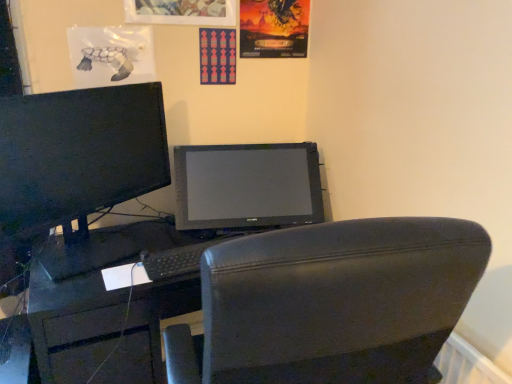
Identify the location of matte pink poster at upper center, which is the first poster page from left to right. The height and width of the screenshot is (384, 512). (217, 56).

In the scene shown: How much space does matte paper poster at upper center, marked as the 2th poster page in a left-to-right arrangement, occupy vertically?

matte paper poster at upper center, marked as the 2th poster page in a left-to-right arrangement, is 42.60 centimeters in height.

What do you see at coordinates (177, 259) in the screenshot?
I see `black matte keyboard at center` at bounding box center [177, 259].

Identify the location of black leather chair at center. The image size is (512, 384). (331, 303).

You are a GUI agent. You are given a task and a screenshot of the screen. Output one action in this format:
    pyautogui.click(x=<x>, y=<y>)
    Task: Click on the matte pink poster at upper center, marked as the 2th poster page in a right-to-left arrangement
    
    Given the screenshot: What is the action you would take?
    pyautogui.click(x=217, y=56)

Does matte pink poster at upper center, which is the first poster page from left to right, turn towards matte paper poster at upper center, marked as the 2th poster page in a left-to-right arrangement?

No, matte pink poster at upper center, which is the first poster page from left to right, is not facing towards matte paper poster at upper center, marked as the 2th poster page in a left-to-right arrangement.

Who is shorter, matte pink poster at upper center, marked as the 2th poster page in a right-to-left arrangement, or matte paper poster at upper center, marked as the 2th poster page in a left-to-right arrangement?

matte pink poster at upper center, marked as the 2th poster page in a right-to-left arrangement.

Which is nearer, (206, 34) or (306, 5)?

Positioned in front is point (206, 34).

Is black leather chair at center outside of matte pink poster at upper center, marked as the 2th poster page in a right-to-left arrangement?

Yes, black leather chair at center is located beyond the bounds of matte pink poster at upper center, marked as the 2th poster page in a right-to-left arrangement.

Is black leather chair at center smaller than matte pink poster at upper center, marked as the 2th poster page in a right-to-left arrangement?

No, black leather chair at center is not smaller than matte pink poster at upper center, marked as the 2th poster page in a right-to-left arrangement.

Is black leather chair at center far from matte pink poster at upper center, marked as the 2th poster page in a right-to-left arrangement?

Yes, black leather chair at center and matte pink poster at upper center, marked as the 2th poster page in a right-to-left arrangement, are quite far apart.

How much distance is there between black matte desk at center and matte pink poster at upper center, which is the first poster page from left to right?

38.28 inches.

Is point (92, 314) closer to camera compared to point (201, 39)?

Yes.

Between black matte desk at center and matte pink poster at upper center, marked as the 2th poster page in a right-to-left arrangement, which one has more height?

Standing taller between the two is black matte desk at center.

What are the coordinates of `keyboard behind the matte black monitor at left` in the screenshot? It's located at (177, 259).

From the image's perspective, would you say black matte keyboard at center is positioned over matte black monitor at left?

No, from the image's perspective, black matte keyboard at center is not above matte black monitor at left.

Consider the image. From the image's perspective, which one is positioned higher, black leather chair at center or black matte keyboard at center?

black matte keyboard at center.

Which is correct: black leather chair at center is inside black matte keyboard at center, or outside of it?

black leather chair at center exists outside the volume of black matte keyboard at center.

Is black leather chair at center looking in the opposite direction of black matte keyboard at center?

No, black matte keyboard at center is not at the back of black leather chair at center.

Is black leather chair at center to the left of black matte keyboard at center from the viewer's perspective?

In fact, black leather chair at center is to the right of black matte keyboard at center.

From a real-world perspective, which poster page is the 1st one above the black matte desk at center? Please provide its 2D coordinates.

[(217, 56)]

Considering the positions of points (201, 83) and (155, 300), is point (201, 83) closer to camera compared to point (155, 300)?

No, it is behind (155, 300).

Is matte pink poster at upper center, which is the first poster page from left to right, oriented towards black matte desk at center?

No.

Is the position of matte pink poster at upper center, marked as the 2th poster page in a right-to-left arrangement, more distant than that of black matte desk at center?

Yes, matte pink poster at upper center, marked as the 2th poster page in a right-to-left arrangement, is further from the camera.

From a real-world perspective, between black matte keyboard at center and matte paper poster at upper center, marked as the 2th poster page in a left-to-right arrangement, who is vertically higher?

matte paper poster at upper center, marked as the 2th poster page in a left-to-right arrangement.

Between black matte keyboard at center and matte paper poster at upper center, marked as the 2th poster page in a left-to-right arrangement, which one has more height?

matte paper poster at upper center, marked as the 2th poster page in a left-to-right arrangement.

Is point (159, 280) farther from camera compared to point (247, 53)?

No, it is in front of (247, 53).

At what (x,y) coordinates should I click in order to perform the action: click on poster page below the matte paper poster at upper center, which appears as the first poster page when viewed from the right (from the image's perspective). Please return your answer as a coordinate pair (x, y). Looking at the image, I should click on (217, 56).

Image resolution: width=512 pixels, height=384 pixels. What are the coordinates of `chair that is under the matte pink poster at upper center, marked as the 2th poster page in a right-to-left arrangement (from a real-world perspective)` in the screenshot? It's located at (331, 303).

When comparing their distances from black matte keyboard at center, does black leather chair at center or matte pink poster at upper center, which is the first poster page from left to right, seem closer?

black leather chair at center lies closer to black matte keyboard at center than the other object.

From the image, which object appears to be farther from black matte keyboard at center, black leather chair at center or matte paper poster at upper center, marked as the 2th poster page in a left-to-right arrangement?

Based on the image, matte paper poster at upper center, marked as the 2th poster page in a left-to-right arrangement, appears to be further to black matte keyboard at center.

Considering their positions, is matte paper poster at upper center, marked as the 2th poster page in a left-to-right arrangement, positioned further to matte pink poster at upper center, marked as the 2th poster page in a right-to-left arrangement, than black matte desk at center?

black matte desk at center is positioned further to the anchor matte pink poster at upper center, marked as the 2th poster page in a right-to-left arrangement.

Estimate the real-world distances between objects in this image. Which object is closer to matte paper poster at upper center, marked as the 2th poster page in a left-to-right arrangement, matte black monitor at left or matte pink poster at upper center, which is the first poster page from left to right?

matte pink poster at upper center, which is the first poster page from left to right, lies closer to matte paper poster at upper center, marked as the 2th poster page in a left-to-right arrangement, than the other object.

Which object lies nearer to the anchor point matte paper poster at upper center, which appears as the first poster page when viewed from the right, black matte keyboard at center or black leather chair at center?

black matte keyboard at center.

Estimate the real-world distances between objects in this image. Which object is further from black matte keyboard at center, matte paper poster at upper center, marked as the 2th poster page in a left-to-right arrangement, or matte black monitor at left?

matte paper poster at upper center, marked as the 2th poster page in a left-to-right arrangement, is positioned further to the anchor black matte keyboard at center.

Looking at this image, based on their spatial positions, is black matte keyboard at center or black matte desk at center further from matte paper poster at upper center, marked as the 2th poster page in a left-to-right arrangement?

black matte desk at center is positioned further to the anchor matte paper poster at upper center, marked as the 2th poster page in a left-to-right arrangement.

Estimate the real-world distances between objects in this image. Which object is closer to black matte keyboard at center, matte black monitor at left or matte pink poster at upper center, marked as the 2th poster page in a right-to-left arrangement?

matte black monitor at left is closer to black matte keyboard at center.

Locate an element on the screen. The image size is (512, 384). computer monitor that lies between matte paper poster at upper center, which appears as the first poster page when viewed from the right, and black leather chair at center from top to bottom is located at coordinates (79, 153).

At what (x,y) coordinates should I click in order to perform the action: click on keyboard between matte black monitor at left and black matte desk at center from top to bottom. Please return your answer as a coordinate pair (x, y). This screenshot has width=512, height=384. Looking at the image, I should click on (177, 259).

The height and width of the screenshot is (384, 512). In order to click on computer monitor between matte paper poster at upper center, marked as the 2th poster page in a left-to-right arrangement, and black matte keyboard at center vertically in this screenshot , I will do `click(79, 153)`.

In order to click on poster page between matte paper poster at upper center, marked as the 2th poster page in a left-to-right arrangement, and black matte keyboard at center from top to bottom in this screenshot , I will do `click(217, 56)`.